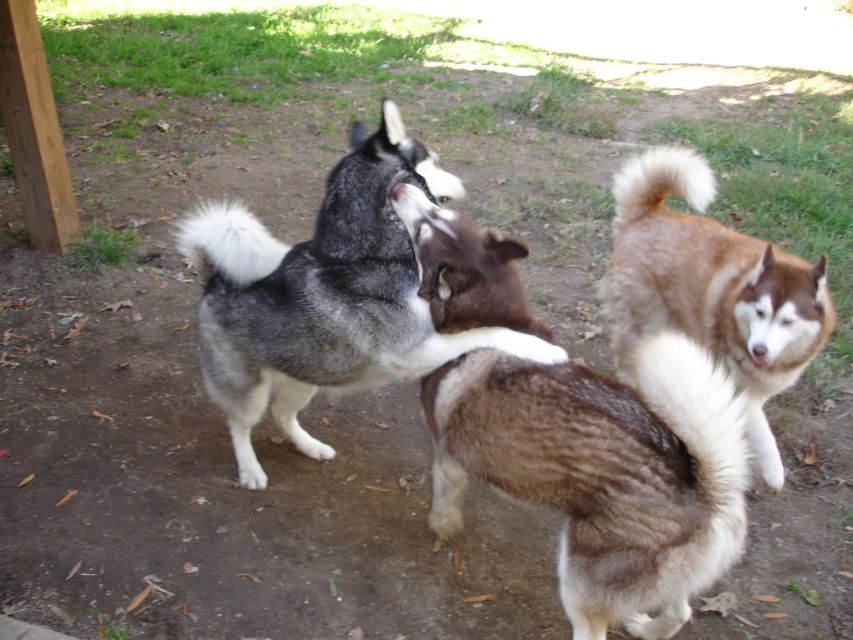
Measure the distance between brown fur at center and gray and white fur husky at center.

A distance of 13.15 inches exists between brown fur at center and gray and white fur husky at center.

Can you confirm if brown fur at center is shorter than gray and white fur husky at center?

Incorrect, brown fur at center's height does not fall short of gray and white fur husky at center's.

Find the location of `brown fur at center`. brown fur at center is located at coordinates (602, 472).

Is gray and white fur husky at center smaller than brown fuzzy dog at right?

No, gray and white fur husky at center is not smaller than brown fuzzy dog at right.

Based on the photo, between gray and white fur husky at center and brown fuzzy dog at right, which one has less height?

gray and white fur husky at center is shorter.

Locate an element on the screen. The image size is (853, 640). gray and white fur husky at center is located at coordinates (323, 296).

Consider the image. Is brown fur at center smaller than brown fuzzy dog at right?

Actually, brown fur at center might be larger than brown fuzzy dog at right.

Image resolution: width=853 pixels, height=640 pixels. In order to click on brown fur at center in this screenshot , I will do `click(602, 472)`.